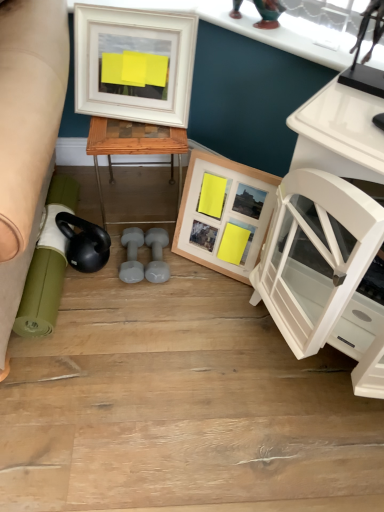
Where is `free space in front of green rubber mat at lower left`? The image size is (384, 512). free space in front of green rubber mat at lower left is located at coordinates (80, 362).